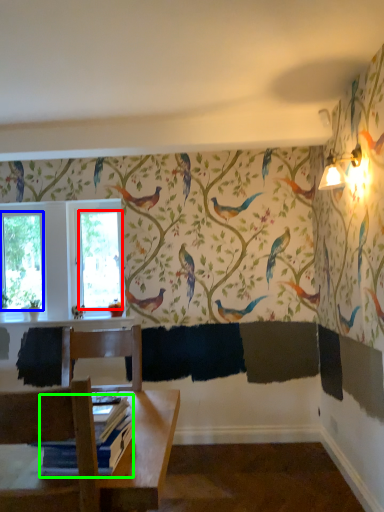
Question: Which object is positioned farthest from window screen (highlighted by a red box)? Select from window screen (highlighted by a blue box) and book (highlighted by a green box).

Choices:
 (A) window screen
 (B) book

Answer: (B)